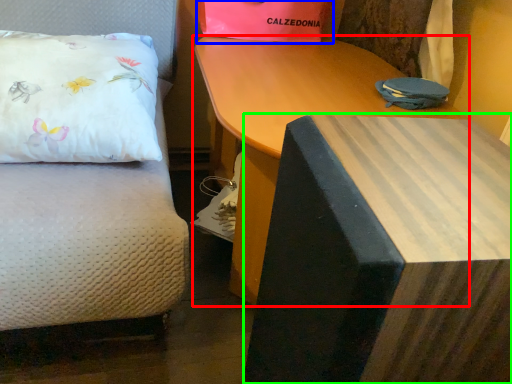
Question: Estimate the real-world distances between objects in this image. Which object is closer to table (highlighted by a red box), gift bag (highlighted by a blue box) or table (highlighted by a green box)?

Choices:
 (A) gift bag
 (B) table

Answer: (A)